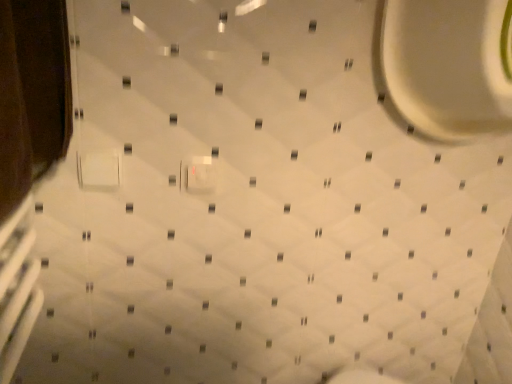
Locate an element on the screen. white glossy toilet at upper right is located at coordinates (448, 65).

What do you see at coordinates (448, 65) in the screenshot? This screenshot has height=384, width=512. I see `white glossy toilet at upper right` at bounding box center [448, 65].

Image resolution: width=512 pixels, height=384 pixels. Find the location of `white glossy toilet at upper right`. white glossy toilet at upper right is located at coordinates (448, 65).